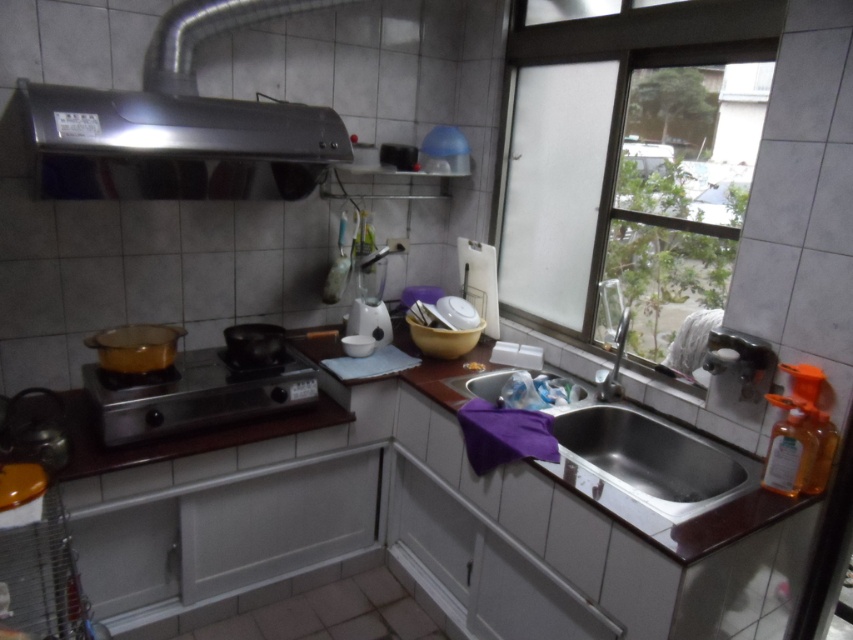
You are standing in the kitchen and need to wash dishes. The sink and stove are both in your line of sight. Which object is nearer to you, the stainless steel sink at lower center or the metallic stove at lower left?

The stainless steel sink at lower center is closer to the viewer than the metallic stove at lower left, so the sink is nearer.

You are a chef standing in the kitchen and want to reach the metallic stove at lower left to adjust the heat. However, there is a stainless steel exhaust hood at upper left blocking your view. Can you move around the exhaust hood to access the stove?

The stainless steel exhaust hood at upper left is in front of the metallic stove at lower left, so you can move around the exhaust hood to access the metallic stove at lower left since it is positioned behind the hood.

You are a window installer assessing the kitchen layout. You need to replace the transparent glass window at upper right and the stainless steel exhaust hood at upper left. Which object requires a wider replacement panel?

The transparent glass window at upper right requires a wider replacement panel since it might be wider than the stainless steel exhaust hood at upper left according to the description.